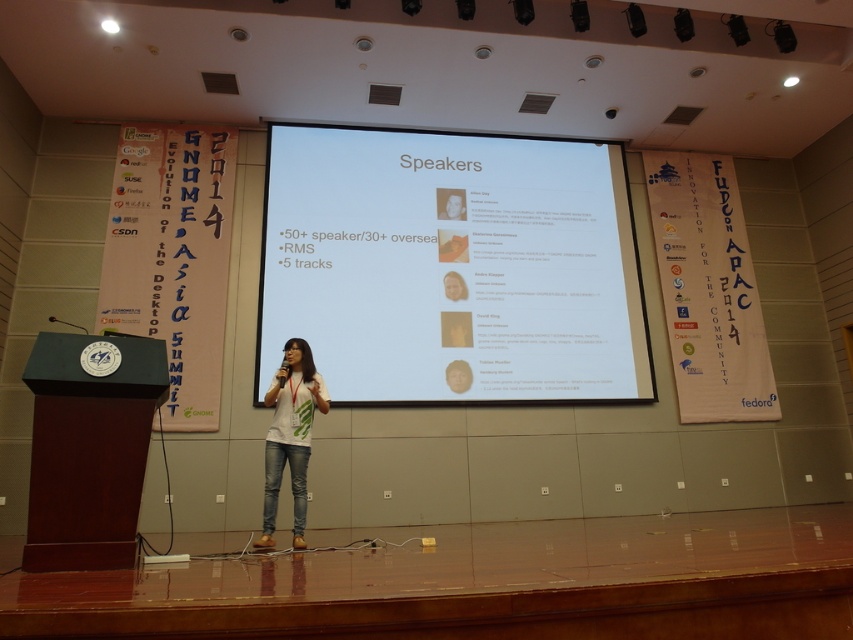
In the scene shown: You are an event organizer setting up a conference. You need to position a new speaker who will stand at the point marked by the coordinate point (451, 266). According to the scene, what object is located at that point?

The white glossy projector screen at center is located at the point marked by the coordinate point (451, 266).